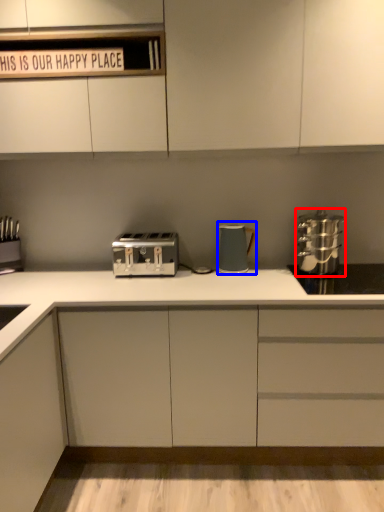
Question: Which object is further to the camera taking this photo, home appliance (highlighted by a red box) or kitchen appliance (highlighted by a blue box)?

Choices:
 (A) home appliance
 (B) kitchen appliance

Answer: (B)